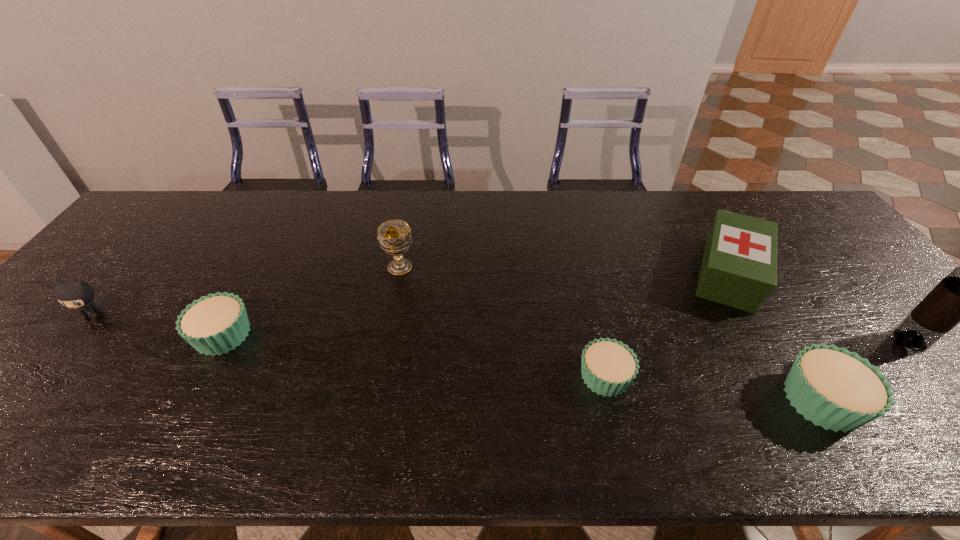
Locate an element on the screen. wine bottle is located at coordinates (959, 297).

You are a GUI agent. You are given a task and a screenshot of the screen. Output one action in this format:
    pyautogui.click(x=<x>, y=<y>)
    Task: Click on the vacant area located on the back of the second tallest cupcake
    The height and width of the screenshot is (540, 960).
    Given the screenshot: What is the action you would take?
    pyautogui.click(x=259, y=265)

You are a GUI agent. You are given a task and a screenshot of the screen. Output one action in this format:
    pyautogui.click(x=<x>, y=<y>)
    Task: Click on the blank space located 0.250m on the left of the shortest cupcake
    The image size is (960, 540).
    Given the screenshot: What is the action you would take?
    pyautogui.click(x=468, y=376)

Find the location of `blank area located 0.360m on the left of the rightmost cupcake`. blank area located 0.360m on the left of the rightmost cupcake is located at coordinates (617, 400).

I want to click on vacant space located on the front of the chalice, so click(x=380, y=372).

At what (x,y) coordinates should I click in order to perform the action: click on free spot located on the right of the first-aid kit. Please return your answer as a coordinate pair (x, y). Looking at the image, I should click on (806, 274).

At what (x,y) coordinates should I click in order to perform the action: click on vacant space situated 0.150m on the front-facing side of the kitten. Please return your answer as a coordinate pair (x, y). This screenshot has height=540, width=960. Looking at the image, I should click on (43, 374).

This screenshot has height=540, width=960. In order to click on vacant region located 0.060m on the back of the wine bottle in this screenshot , I will do point(884,310).

You are a GUI agent. You are given a task and a screenshot of the screen. Output one action in this format:
    pyautogui.click(x=<x>, y=<y>)
    Task: Click on the object that is positioned at the left edge
    
    Given the screenshot: What is the action you would take?
    pyautogui.click(x=76, y=294)

Identify the location of object situated at the right edge. The height and width of the screenshot is (540, 960). (959, 297).